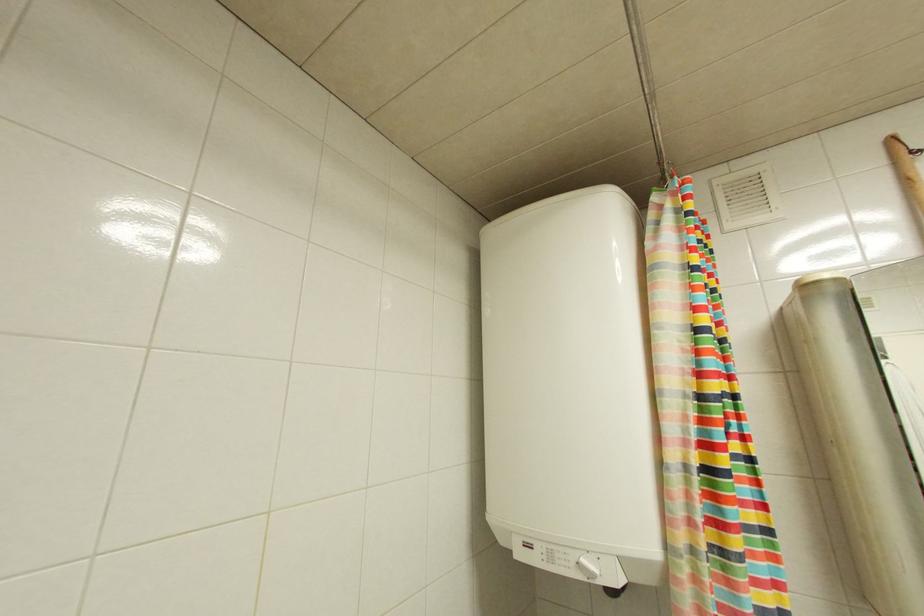
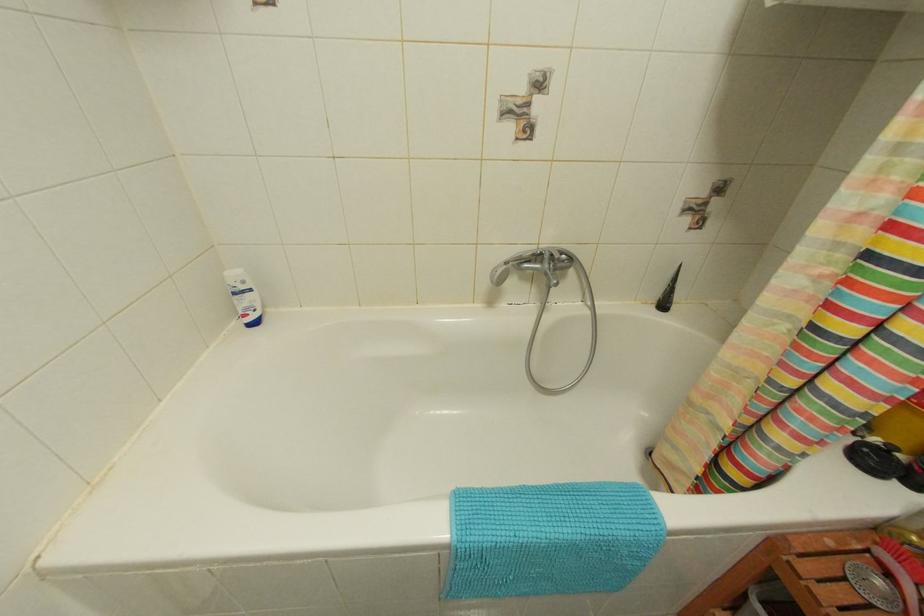
How did the camera likely rotate?

The rotation direction of the camera is left-down.